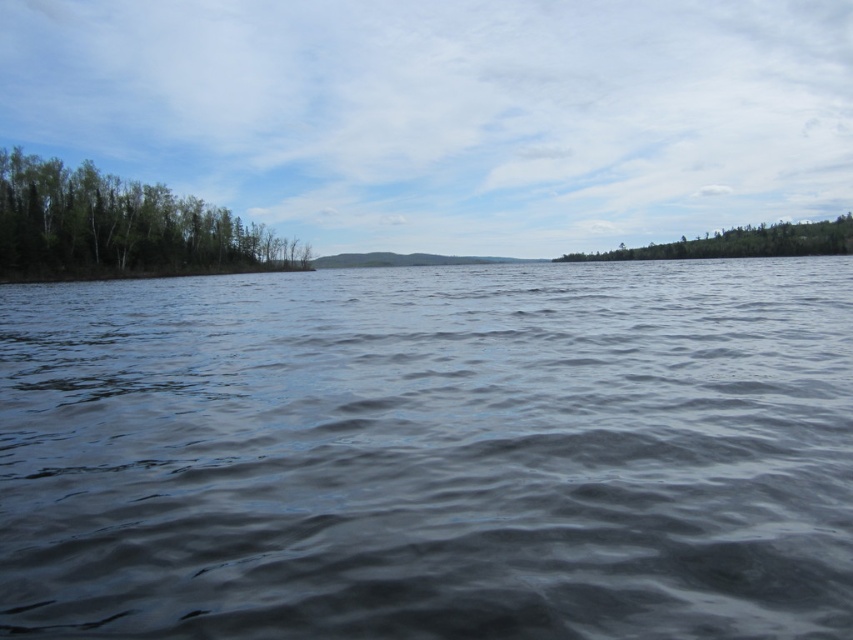
Question: Which object is positioned closest to the green leafy trees at right?

Choices:
 (A) dark blue water at center
 (B) green leafy trees at left

Answer: (B)

Question: Can you confirm if dark blue water at center is thinner than transparent water at center?

Choices:
 (A) no
 (B) yes

Answer: (B)

Question: In this image, where is dark blue water at center located relative to transparent water at center?

Choices:
 (A) right
 (B) left

Answer: (B)

Question: Does dark blue water at center appear on the left side of green leafy trees at right?

Choices:
 (A) no
 (B) yes

Answer: (B)

Question: Which object is farther from the camera taking this photo?

Choices:
 (A) green leafy trees at right
 (B) green leafy trees at left

Answer: (A)

Question: Which object is closer to the camera taking this photo?

Choices:
 (A) dark blue water at center
 (B) green leafy trees at left
 (C) transparent water at center

Answer: (A)